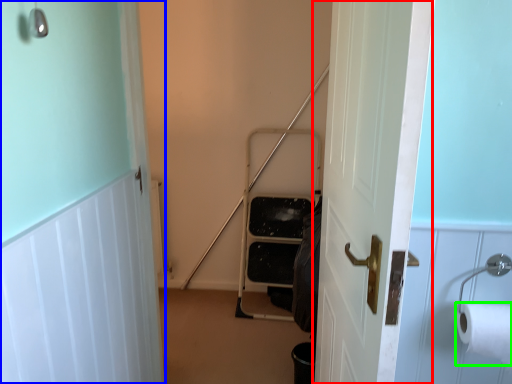
Question: Which object is the farthest from door (highlighted by a red box)? Choose among these: door (highlighted by a blue box) or toilet paper (highlighted by a green box).

Choices:
 (A) door
 (B) toilet paper

Answer: (A)